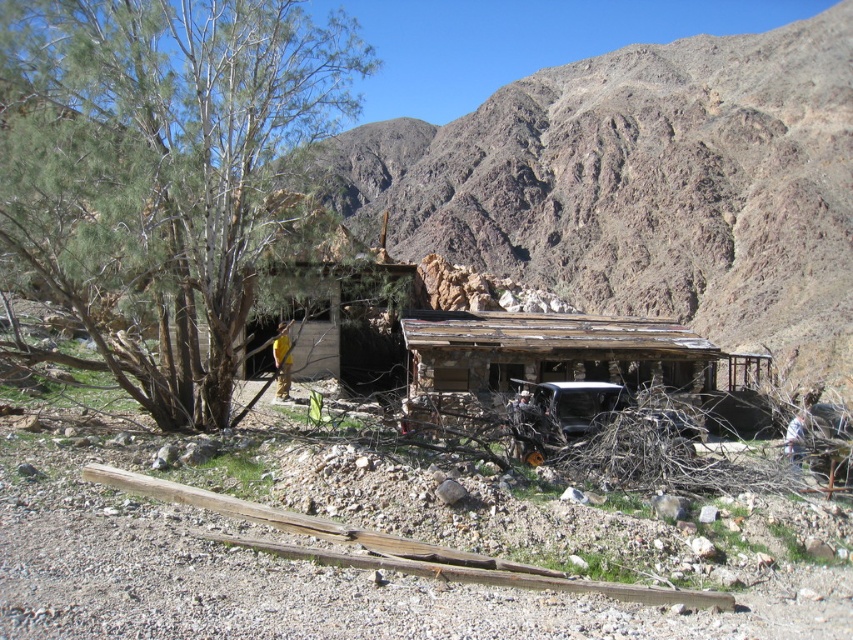
You are standing at the point marked by the coordinates point (161, 164). Looking around, you see the green leafy tree at left. Which direction should you face to see the green leafy tree at left?

You are already facing the green leafy tree at left because the point (161, 164) is where the tree is located.

You are standing in front of the rustic wooden structure and want to take a photo that includes both point (831, 65) and point (460, 328). Which point should you focus on first to ensure both are in clear view?

You should focus on point (460, 328) first because it is closer to the camera than point (831, 65), ensuring both points are in focus when using depth of field.

You are standing in front of the weathered wood hut at center and want to go to the green leafy tree at left. Which direction should you face to walk towards it?

You should face to the left to walk towards the green leafy tree at left from the weathered wood hut at center because the green leafy tree at left is located to the left of the weathered wood hut at center.